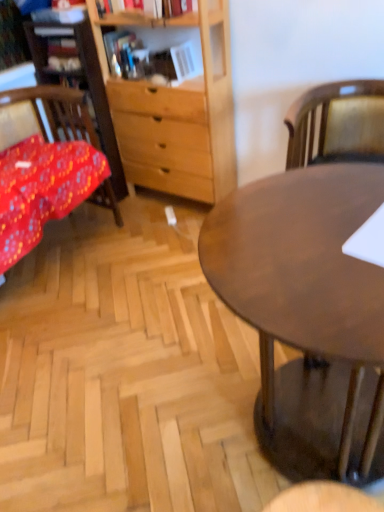
This screenshot has width=384, height=512. I want to click on free spot above wooden desk at center (from a real-world perspective), so click(x=299, y=244).